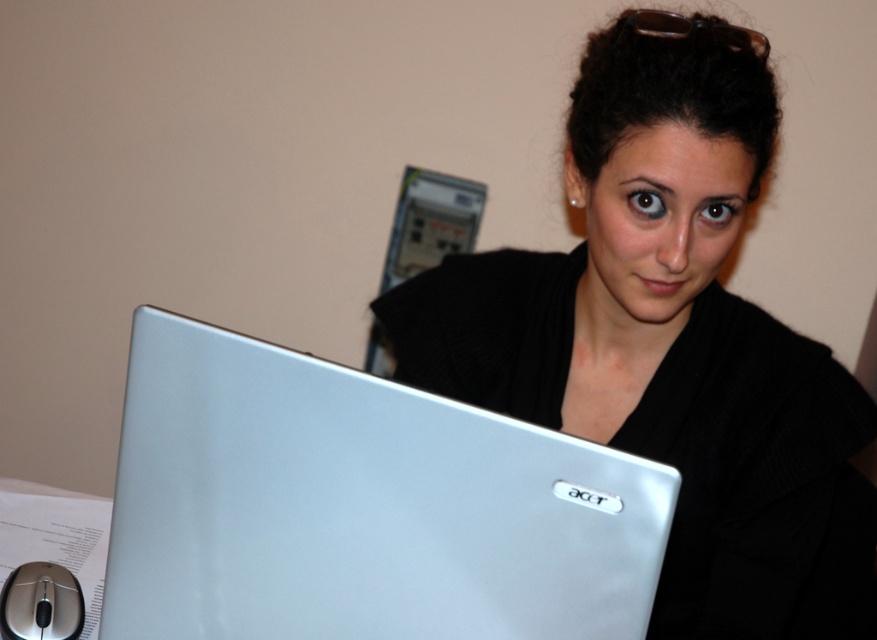
Image resolution: width=877 pixels, height=640 pixels. What do you see at coordinates (359, 506) in the screenshot?
I see `silver metallic laptop at center` at bounding box center [359, 506].

Between point (243, 570) and point (48, 600), which one is positioned in front?

Point (243, 570) is in front.

Is point (529, 454) less distant than point (22, 592)?

Yes, it is.

Image resolution: width=877 pixels, height=640 pixels. I want to click on silver metallic laptop at center, so click(x=359, y=506).

Who is more distant from viewer, (672, 316) or (20, 624)?

The point (672, 316) is more distant.

Locate an element on the screen. Image resolution: width=877 pixels, height=640 pixels. matte silver laptop at center is located at coordinates (671, 339).

Between matte silver laptop at center and silver metallic laptop at center, which one has more height?

With more height is matte silver laptop at center.

Is matte silver laptop at center taller than silver metallic laptop at center?

Correct, matte silver laptop at center is much taller as silver metallic laptop at center.

Does point (833, 481) come farther from viewer compared to point (329, 573)?

That is True.

Find the location of a particular element. The width and height of the screenshot is (877, 640). matte silver laptop at center is located at coordinates (671, 339).